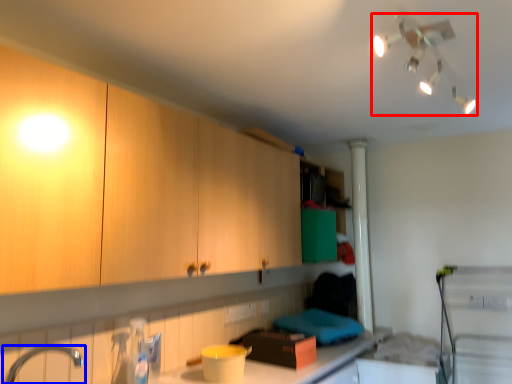
Question: Among these objects, which one is farthest to the camera, light fixture (highlighted by a red box) or tap (highlighted by a blue box)?

Choices:
 (A) light fixture
 (B) tap

Answer: (B)